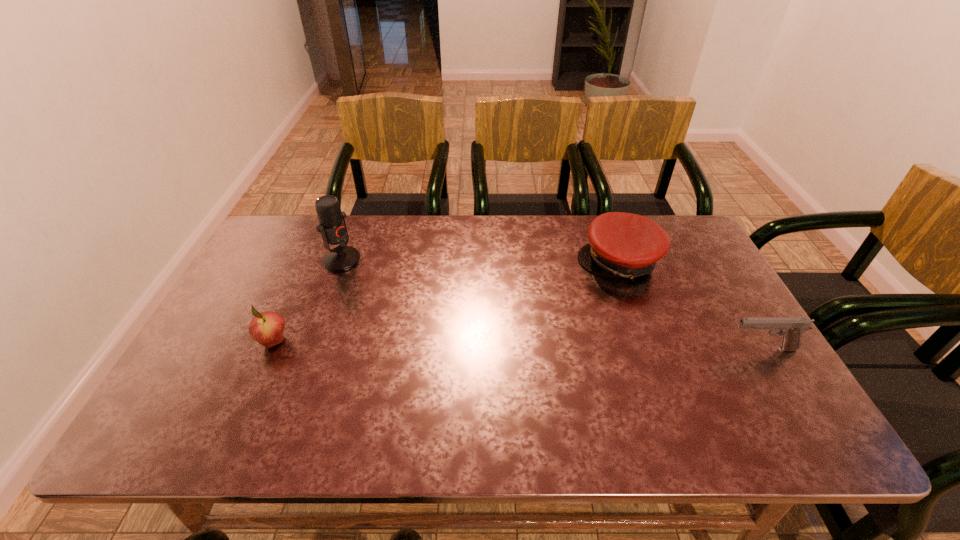
The width and height of the screenshot is (960, 540). What are the coordinates of `the leftmost object` in the screenshot? It's located at (267, 328).

The height and width of the screenshot is (540, 960). I want to click on pistol, so click(x=791, y=329).

Locate an element on the screen. cap is located at coordinates (627, 245).

This screenshot has height=540, width=960. I want to click on the third object from right to left, so click(332, 226).

Locate an element on the screen. This screenshot has height=540, width=960. the tallest object is located at coordinates (332, 226).

You are a GUI agent. You are given a task and a screenshot of the screen. Output one action in this format:
    pyautogui.click(x=<x>, y=<y>)
    Task: Click on the vacant space located 0.120m on the front of the leftmost object
    This screenshot has width=960, height=540.
    Given the screenshot: What is the action you would take?
    pyautogui.click(x=250, y=396)

Where is `vacant space positioned 0.240m at the barrel of the rightmost object`? This screenshot has height=540, width=960. vacant space positioned 0.240m at the barrel of the rightmost object is located at coordinates (631, 349).

Find the location of `blank space located at the barrel of the rightmost object`. blank space located at the barrel of the rightmost object is located at coordinates pyautogui.click(x=686, y=349).

Where is `vacant region located at the barrel of the rightmost object`? Image resolution: width=960 pixels, height=540 pixels. vacant region located at the barrel of the rightmost object is located at coordinates (638, 349).

Image resolution: width=960 pixels, height=540 pixels. I want to click on vacant area situated at the front of the cap where the visor is located, so click(x=576, y=291).